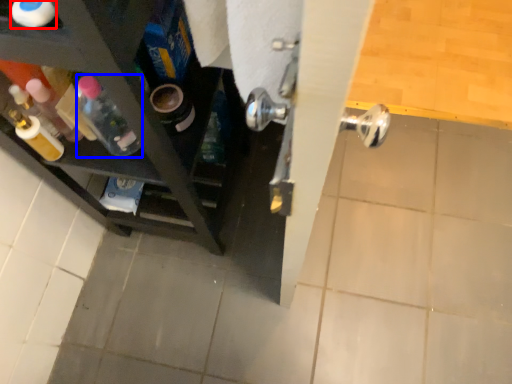
Question: Among these objects, which one is farthest to the camera, bottle (highlighted by a red box) or bottle (highlighted by a blue box)?

Choices:
 (A) bottle
 (B) bottle

Answer: (B)